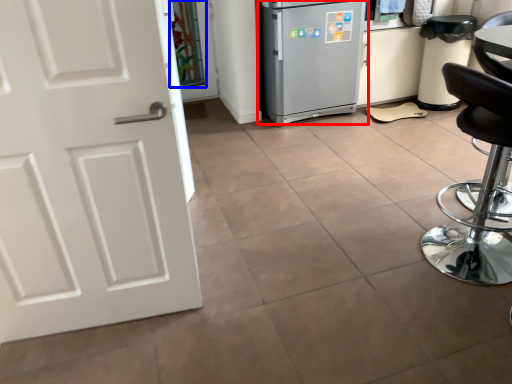
Question: Which of the following is the closest to the observer, refrigerator (highlighted by a red box) or glass door (highlighted by a blue box)?

Choices:
 (A) refrigerator
 (B) glass door

Answer: (A)